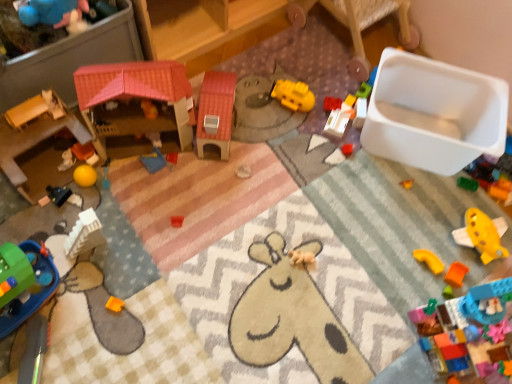
In order to click on vacant area on the back side of translucent blue plastic blocks at lower right, the third toy viewed from the right in this screenshot , I will do `click(425, 271)`.